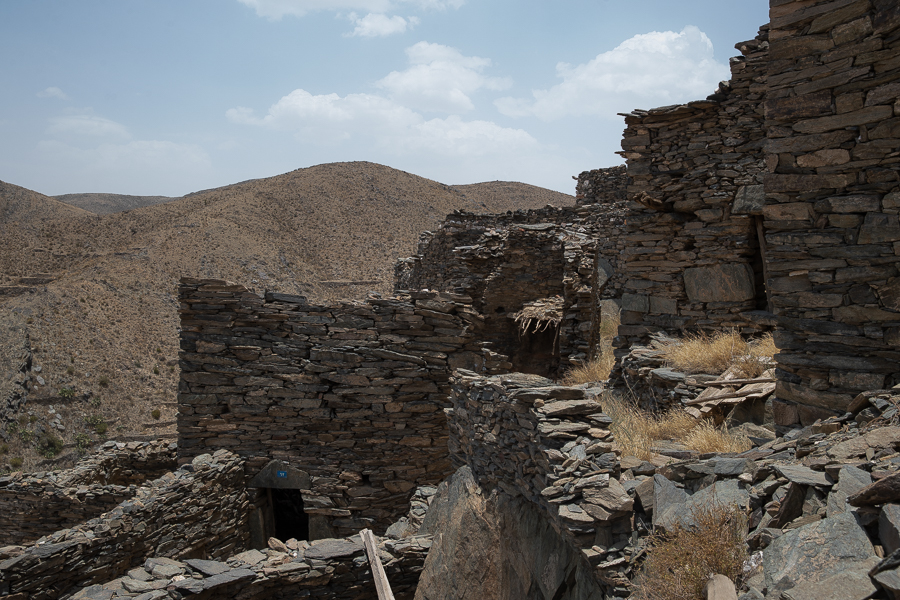
Identify the location of blue label above doorway. This screenshot has height=600, width=900. [x=280, y=477].